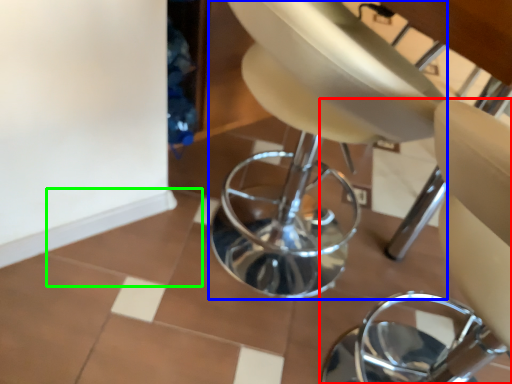
Question: Based on their relative distances, which object is nearer to chair (highlighted by a red box)? Choose from swivel chair (highlighted by a blue box) and ceramic tile (highlighted by a green box).

Choices:
 (A) swivel chair
 (B) ceramic tile

Answer: (A)